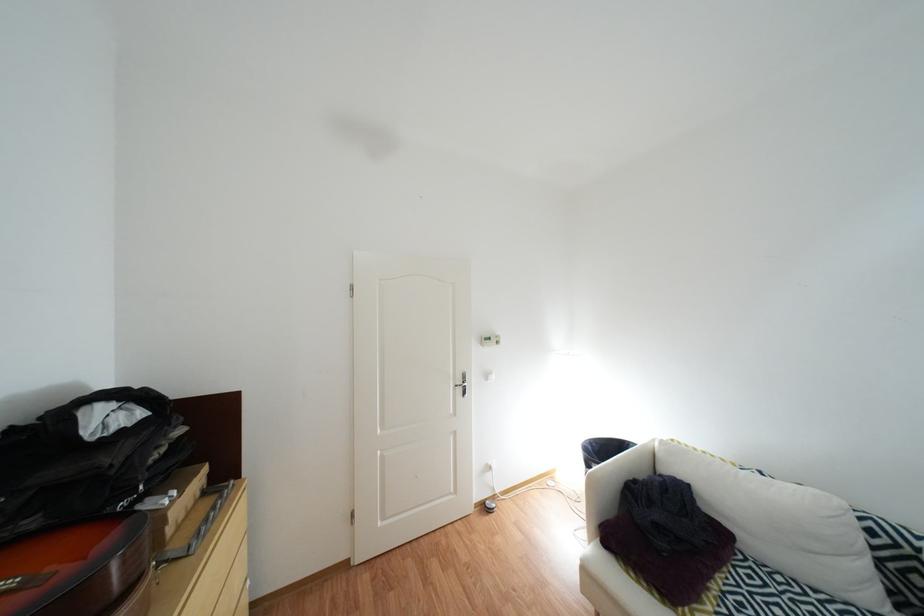
What do you see at coordinates (613, 484) in the screenshot? This screenshot has width=924, height=616. I see `the white sofa armrest` at bounding box center [613, 484].